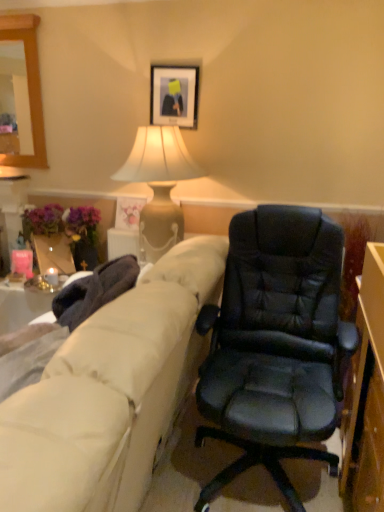
Identify the location of beige fabric couch at left. The image size is (384, 512). (111, 392).

What is the approximate height of black matte picture frame at upper center, which appears as the 2th picture frame when viewed from the left?

42.38 centimeters.

What do you see at coordinates (159, 186) in the screenshot? I see `matte beige lamp at upper center` at bounding box center [159, 186].

What do you see at coordinates (128, 212) in the screenshot? I see `matte floral print picture frame at upper center, acting as the 1th picture frame starting from the left` at bounding box center [128, 212].

You are a GUI agent. You are given a task and a screenshot of the screen. Output one action in this format:
    pyautogui.click(x=<x>, y=<y>)
    Task: Click on the beige fabric couch at left
    The image size is (384, 512).
    Given the screenshot: What is the action you would take?
    pyautogui.click(x=111, y=392)

Is point (268, 223) positioned after point (142, 129)?

No, it is in front of (142, 129).

How different are the orientations of black leather chair at center and matte beige lamp at upper center in degrees?

They differ by 0.0468 degrees in their facing directions.

The image size is (384, 512). Identify the location of chair directly beneath the matte beige lamp at upper center (from a real-world perspective). (275, 345).

Is black leather chair at center next to matte beige lamp at upper center?

No.

Consider the image. Is matte beige lamp at upper center placed right next to matte floral print picture frame at upper center, positioned as the first picture frame in bottom-to-top order?

matte beige lamp at upper center and matte floral print picture frame at upper center, positioned as the first picture frame in bottom-to-top order, are clearly separated.

Looking at this image, between matte beige lamp at upper center and matte floral print picture frame at upper center, the 1th picture frame in the back-to-front sequence, which one has smaller size?

Smaller between the two is matte floral print picture frame at upper center, the 1th picture frame in the back-to-front sequence.

Which object is more forward, matte beige lamp at upper center or matte floral print picture frame at upper center, positioned as the first picture frame in bottom-to-top order?

Positioned in front is matte beige lamp at upper center.

Does black matte picture frame at upper center, the second picture frame positioned from the bottom, turn towards matte beige lamp at upper center?

No, black matte picture frame at upper center, the second picture frame positioned from the bottom, is not turned towards matte beige lamp at upper center.

Is black matte picture frame at upper center, which appears as the 2th picture frame when viewed from the left, directly adjacent to matte beige lamp at upper center?

No, black matte picture frame at upper center, which appears as the 2th picture frame when viewed from the left, is not in contact with matte beige lamp at upper center.

I want to click on picture frame above the matte beige lamp at upper center (from a real-world perspective), so click(174, 95).

Considering the relative positions of matte beige lamp at upper center and black matte picture frame at upper center, the 1th picture frame when ordered from top to bottom, in the image provided, is matte beige lamp at upper center to the right of black matte picture frame at upper center, the 1th picture frame when ordered from top to bottom, from the viewer's perspective?

In fact, matte beige lamp at upper center is to the left of black matte picture frame at upper center, the 1th picture frame when ordered from top to bottom.

Based on the photo, from the image's perspective, who appears lower, matte beige lamp at upper center or black matte picture frame at upper center, positioned as the 2th picture frame in back-to-front order?

matte beige lamp at upper center is shown below in the image.

From a real-world perspective, which object stands above the other?

In real-world perspective, black matte picture frame at upper center, the second picture frame positioned from the bottom, is above.

Does beige fabric couch at left appear on the right side of black matte picture frame at upper center, placed as the first picture frame when sorted from front to back?

Incorrect, beige fabric couch at left is not on the right side of black matte picture frame at upper center, placed as the first picture frame when sorted from front to back.

Based on the photo, is beige fabric couch at left not inside black matte picture frame at upper center, marked as the 1th picture frame in a right-to-left arrangement?

beige fabric couch at left lies outside black matte picture frame at upper center, marked as the 1th picture frame in a right-to-left arrangement,'s area.

From a real-world perspective, does beige fabric couch at left sit lower than black matte picture frame at upper center, which appears as the 2th picture frame when viewed from the left?

Yes.

Is beige fabric couch at left taller or shorter than black matte picture frame at upper center, the 1th picture frame when ordered from top to bottom?

Clearly, beige fabric couch at left is taller compared to black matte picture frame at upper center, the 1th picture frame when ordered from top to bottom.

Does black matte picture frame at upper center, positioned as the 2th picture frame in back-to-front order, lie in front of beige fabric couch at left?

No, it is behind beige fabric couch at left.

Is black matte picture frame at upper center, the 1th picture frame when ordered from top to bottom, inside the boundaries of beige fabric couch at left, or outside?

black matte picture frame at upper center, the 1th picture frame when ordered from top to bottom, is located beyond the bounds of beige fabric couch at left.

Is black matte picture frame at upper center, which appears as the 2th picture frame when viewed from the left, next to beige fabric couch at left?

black matte picture frame at upper center, which appears as the 2th picture frame when viewed from the left, is not next to beige fabric couch at left, and they're not touching.

Does point (153, 76) lie in front of point (67, 456)?

No, (153, 76) is behind (67, 456).

From a real-world perspective, is matte floral print picture frame at upper center, positioned as the first picture frame in bottom-to-top order, positioned under black matte picture frame at upper center, the second picture frame positioned from the bottom, based on gravity?

Correct, in the physical world, matte floral print picture frame at upper center, positioned as the first picture frame in bottom-to-top order, is lower than black matte picture frame at upper center, the second picture frame positioned from the bottom.

This screenshot has width=384, height=512. I want to click on picture frame on the right of the matte floral print picture frame at upper center, the 1th picture frame in the back-to-front sequence, so click(x=174, y=95).

How different are the orientations of matte floral print picture frame at upper center, the 1th picture frame in the back-to-front sequence, and black matte picture frame at upper center, the second picture frame positioned from the bottom, in degrees?

The angle between the facing direction of matte floral print picture frame at upper center, the 1th picture frame in the back-to-front sequence, and the facing direction of black matte picture frame at upper center, the second picture frame positioned from the bottom, is 0.437 degrees.

Which object is more forward, matte floral print picture frame at upper center, the 2th picture frame in the top-to-bottom sequence, or black matte picture frame at upper center, positioned as the 2th picture frame in back-to-front order?

black matte picture frame at upper center, positioned as the 2th picture frame in back-to-front order, is more forward.

The image size is (384, 512). I want to click on chair below the matte beige lamp at upper center (from the image's perspective), so click(275, 345).

Find the location of a particular element. lamp on the right of matte floral print picture frame at upper center, the 2th picture frame in the top-to-bottom sequence is located at coordinates pyautogui.click(x=159, y=186).

Based on their spatial positions, is black matte picture frame at upper center, placed as the first picture frame when sorted from front to back, or beige fabric couch at left closer to black leather chair at center?

beige fabric couch at left.

From the image, which object appears to be nearer to beige fabric couch at left, matte beige lamp at upper center or black matte picture frame at upper center, the 1th picture frame when ordered from top to bottom?

matte beige lamp at upper center lies closer to beige fabric couch at left than the other object.

Estimate the real-world distances between objects in this image. Which object is closer to beige fabric couch at left, matte floral print picture frame at upper center, the 2th picture frame in the top-to-bottom sequence, or black leather chair at center?

The object closer to beige fabric couch at left is black leather chair at center.

When comparing their distances from beige fabric couch at left, does black leather chair at center or matte beige lamp at upper center seem further?

The object further to beige fabric couch at left is matte beige lamp at upper center.

Which object lies nearer to the anchor point black leather chair at center, black matte picture frame at upper center, which appears as the 2th picture frame when viewed from the left, or matte floral print picture frame at upper center, acting as the 1th picture frame starting from the left?

matte floral print picture frame at upper center, acting as the 1th picture frame starting from the left.

Consider the image. Based on their spatial positions, is beige fabric couch at left or black matte picture frame at upper center, the 1th picture frame when ordered from top to bottom, further from matte floral print picture frame at upper center, positioned as the 2th picture frame in right-to-left order?

Among the two, beige fabric couch at left is located further to matte floral print picture frame at upper center, positioned as the 2th picture frame in right-to-left order.

Considering their positions, is matte floral print picture frame at upper center, marked as the second picture frame in a front-to-back arrangement, positioned closer to matte beige lamp at upper center than black matte picture frame at upper center, positioned as the 2th picture frame in back-to-front order?

matte floral print picture frame at upper center, marked as the second picture frame in a front-to-back arrangement.

Looking at the image, which one is located further to matte floral print picture frame at upper center, acting as the 1th picture frame starting from the left, beige fabric couch at left or black leather chair at center?

beige fabric couch at left is positioned further to the anchor matte floral print picture frame at upper center, acting as the 1th picture frame starting from the left.

This screenshot has height=512, width=384. I want to click on picture frame positioned between beige fabric couch at left and matte floral print picture frame at upper center, acting as the 1th picture frame starting from the left, from near to far, so click(x=174, y=95).

Locate an element on the screen. lamp that lies between black matte picture frame at upper center, the second picture frame positioned from the bottom, and black leather chair at center from top to bottom is located at coordinates (159, 186).

You are a GUI agent. You are given a task and a screenshot of the screen. Output one action in this format:
    pyautogui.click(x=<x>, y=<y>)
    Task: Click on the lamp positioned between beige fabric couch at left and black matte picture frame at upper center, positioned as the 2th picture frame in back-to-front order, from near to far
    The width and height of the screenshot is (384, 512).
    Given the screenshot: What is the action you would take?
    pyautogui.click(x=159, y=186)

Locate an element on the screen. The width and height of the screenshot is (384, 512). chair between beige fabric couch at left and black matte picture frame at upper center, the second picture frame positioned from the bottom, from front to back is located at coordinates (275, 345).